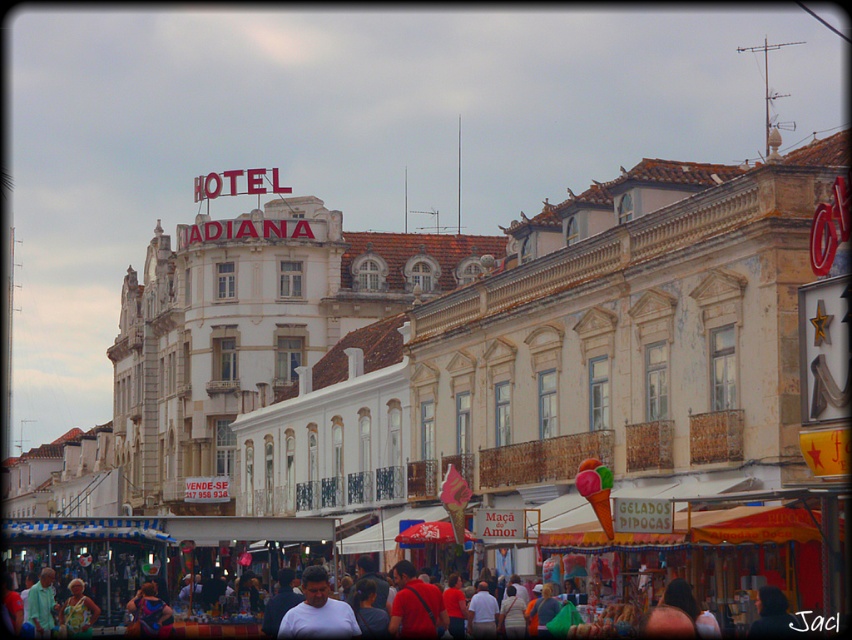
You are a tourist standing on the street looking at the HOTEL DIANA sign. You notice two items of clothing at the center of the image. Which one is taller between the red fabric shirt at center and the floral printed dress at center?

The red fabric shirt at center is taller than the floral printed dress at center.

You are a tour guide leading a group through this historic town. You notice a tourist wearing a white matte shirt at center and another tourist wearing a red fabric shirt at center. If you want to ensure all your tourists can hear you clearly, and your voice can carry up to 10 feet, will both tourists be within hearing range?

The distance between the white matte shirt at center and red fabric shirt at center is 12.35 feet, which exceeds the 10 feet range your voice can carry. Therefore, not all tourists will be within hearing range.